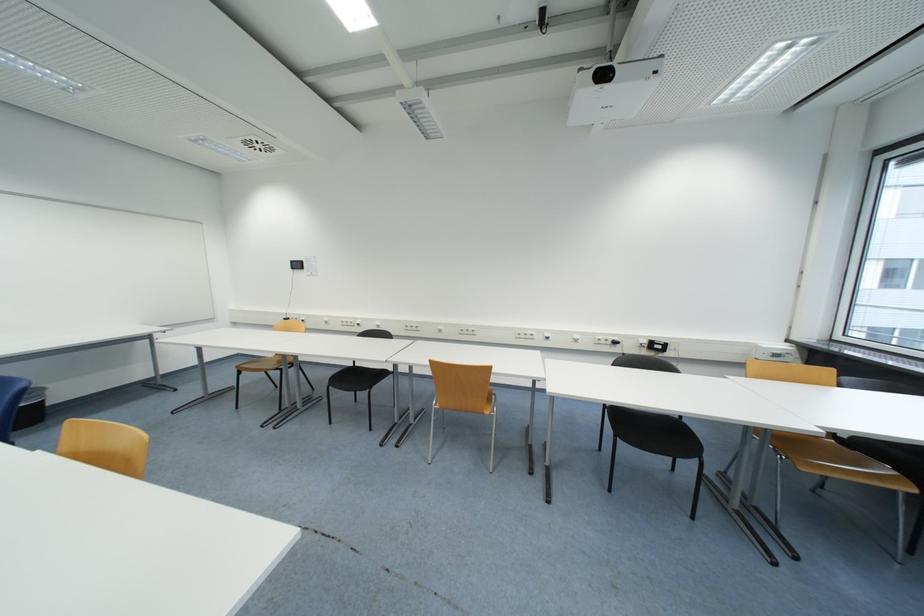
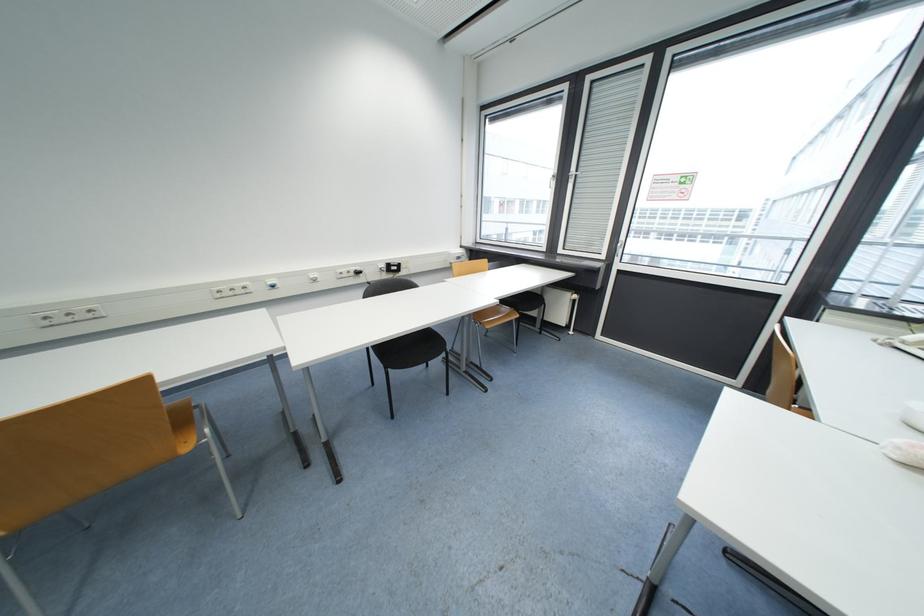
Locate, in the second image, the point that corresponds to the point at 551,337 in the first image.

(274, 285)